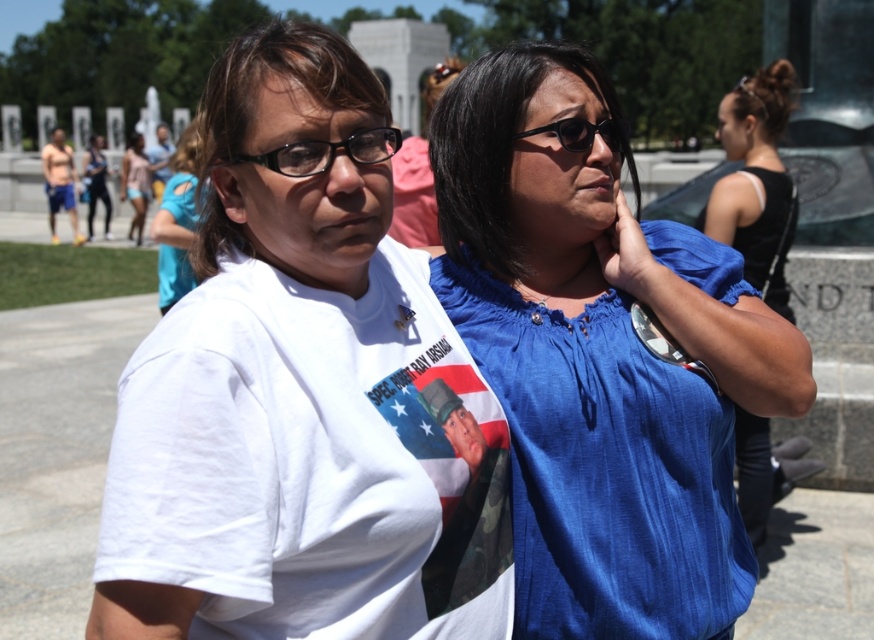
From the picture: You are a photographer trying to capture a closeup of the black plastic glasses at center without including the blue cotton shirt at center in the frame. Is this possible given their positions?

The blue cotton shirt at center is further to the viewer than black plastic glasses at center. Since the shirt is closer to you, it would block the view of the glasses behind it, making it impossible to capture the glasses without the shirt in the frame.

You are a photographer trying to capture the white cotton shirt at left in the center of your photo. The camera you are using has a fixed focus point at the center. Where should you position the shirt relative to the frame?

To center the white cotton shirt at left in the photo, position it so that its location at point (177, 220) aligns with the center of the frame.